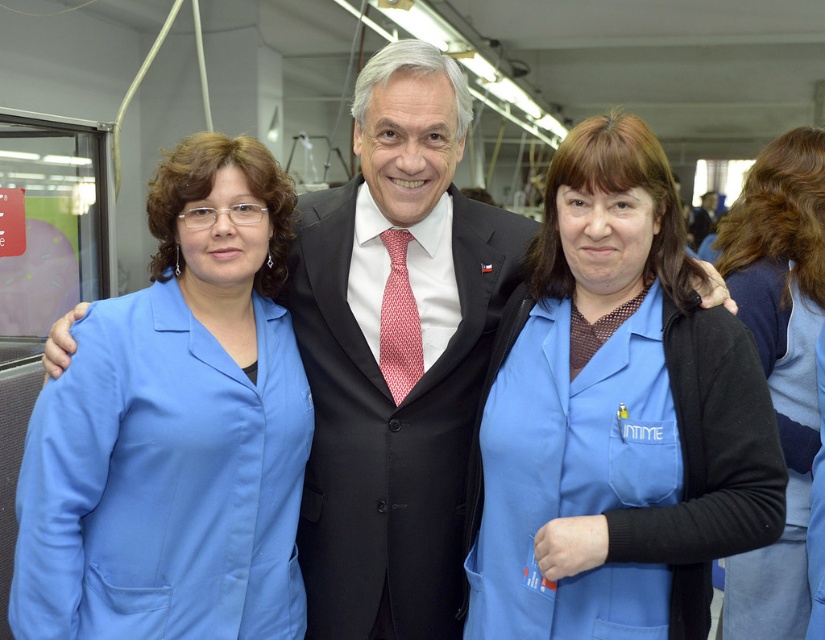
You are a photographer positioned in the train car and want to take a photo of the blue fabric uniform at center and the black satin suit at center. Which object should you focus on first to ensure both are in focus?

The blue fabric uniform at center is closer to the viewer than the black satin suit at center, so you should focus on the blue fabric uniform at center first to ensure both are in focus.

You are a photographer standing in the public transportation setting. You need to adjust your camera to focus on both the black satin suit at center and the blue fabric shirt at right. Which one should you focus on first to ensure both are in clear view?

The black satin suit at center is in front of the blue fabric shirt at right, so you should focus on the black satin suit at center first to ensure both are in clear view.